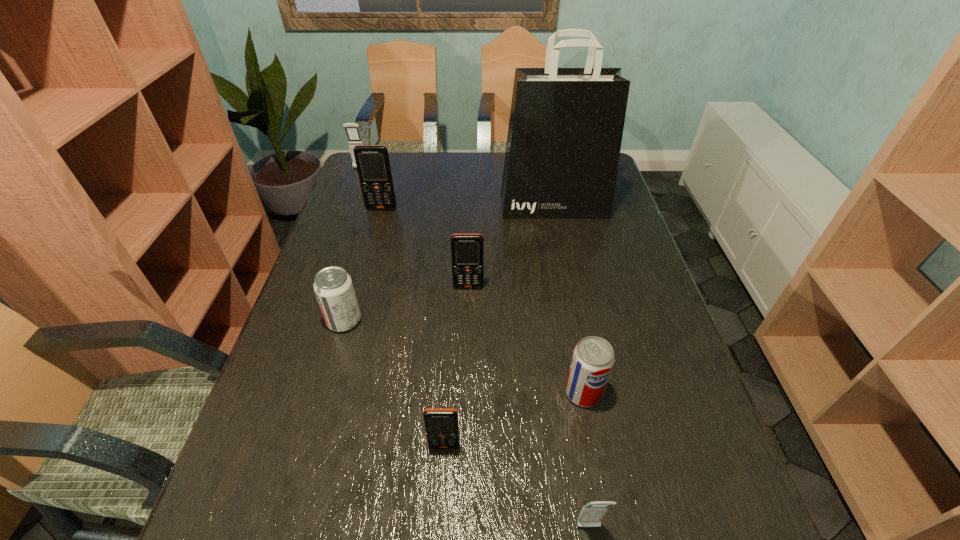
Identify the location of the fifth farthest object. (333, 287).

Where is `the left soda can`? the left soda can is located at coordinates (333, 287).

Locate an element on the screen. The width and height of the screenshot is (960, 540). the fourth farthest cellular telephone is located at coordinates [x=441, y=424].

At what (x,y) coordinates should I click in order to perform the action: click on the nearest orange cellular telephone. Please return your answer as a coordinate pair (x, y). Image resolution: width=960 pixels, height=540 pixels. Looking at the image, I should click on (441, 424).

The width and height of the screenshot is (960, 540). I want to click on the right gray cellular telephone, so click(592, 513).

This screenshot has height=540, width=960. What are the coordinates of `the nearest cellular telephone` in the screenshot? It's located at tap(592, 513).

Where is `blank space located on the front with handles of the shopping bag`? The height and width of the screenshot is (540, 960). blank space located on the front with handles of the shopping bag is located at coordinates (567, 273).

You are a GUI agent. You are given a task and a screenshot of the screen. Output one action in this format:
    pyautogui.click(x=<x>, y=<y>)
    Task: Click on the vacant space located on the screen of the fourth cellular telephone from right to left
    This screenshot has width=960, height=540.
    Given the screenshot: What is the action you would take?
    pyautogui.click(x=364, y=275)

Find the location of a particular element. The image size is (960, 540). free location located 0.230m on the front-facing side of the bigger gray cellular telephone is located at coordinates (x=347, y=207).

Where is `free space located 0.370m on the screen of the fourth farthest object`? free space located 0.370m on the screen of the fourth farthest object is located at coordinates (465, 418).